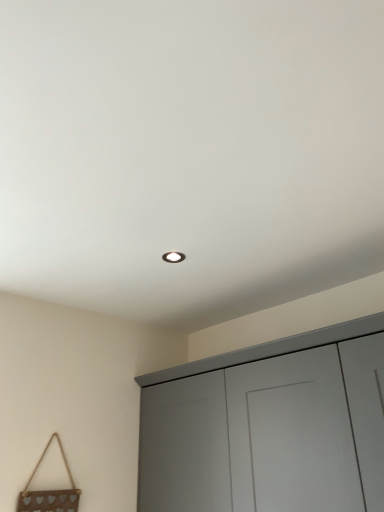
Question: Considering the relative sizes of matte gray cupboard at lower right and metallic heart-shaped decoration at lower left in the image provided, is matte gray cupboard at lower right wider than metallic heart-shaped decoration at lower left?

Choices:
 (A) yes
 (B) no

Answer: (A)

Question: Is metallic heart-shaped decoration at lower left inside matte gray cupboard at lower right?

Choices:
 (A) no
 (B) yes

Answer: (A)

Question: Would you say matte gray cupboard at lower right is outside metallic heart-shaped decoration at lower left?

Choices:
 (A) no
 (B) yes

Answer: (B)

Question: From the image's perspective, is matte gray cupboard at lower right located above metallic heart-shaped decoration at lower left?

Choices:
 (A) yes
 (B) no

Answer: (A)

Question: Can you confirm if matte gray cupboard at lower right is smaller than metallic heart-shaped decoration at lower left?

Choices:
 (A) yes
 (B) no

Answer: (B)

Question: From a real-world perspective, is matte gray cupboard at lower right under metallic heart-shaped decoration at lower left?

Choices:
 (A) no
 (B) yes

Answer: (A)

Question: Does metallic heart-shaped decoration at lower left have a lesser height compared to matte gray cupboard at lower right?

Choices:
 (A) yes
 (B) no

Answer: (A)

Question: Is metallic heart-shaped decoration at lower left far away from matte gray cupboard at lower right?

Choices:
 (A) yes
 (B) no

Answer: (B)

Question: Is the position of metallic heart-shaped decoration at lower left less distant than that of matte gray cupboard at lower right?

Choices:
 (A) yes
 (B) no

Answer: (B)

Question: Does metallic heart-shaped decoration at lower left touch matte gray cupboard at lower right?

Choices:
 (A) no
 (B) yes

Answer: (A)

Question: Considering the relative positions of metallic heart-shaped decoration at lower left and matte gray cupboard at lower right in the image provided, is metallic heart-shaped decoration at lower left to the left of matte gray cupboard at lower right from the viewer's perspective?

Choices:
 (A) yes
 (B) no

Answer: (A)

Question: From the image's perspective, is metallic heart-shaped decoration at lower left below matte gray cupboard at lower right?

Choices:
 (A) yes
 (B) no

Answer: (A)

Question: Based on their sizes in the image, would you say matte gray cupboard at lower right is bigger or smaller than metallic heart-shaped decoration at lower left?

Choices:
 (A) big
 (B) small

Answer: (A)